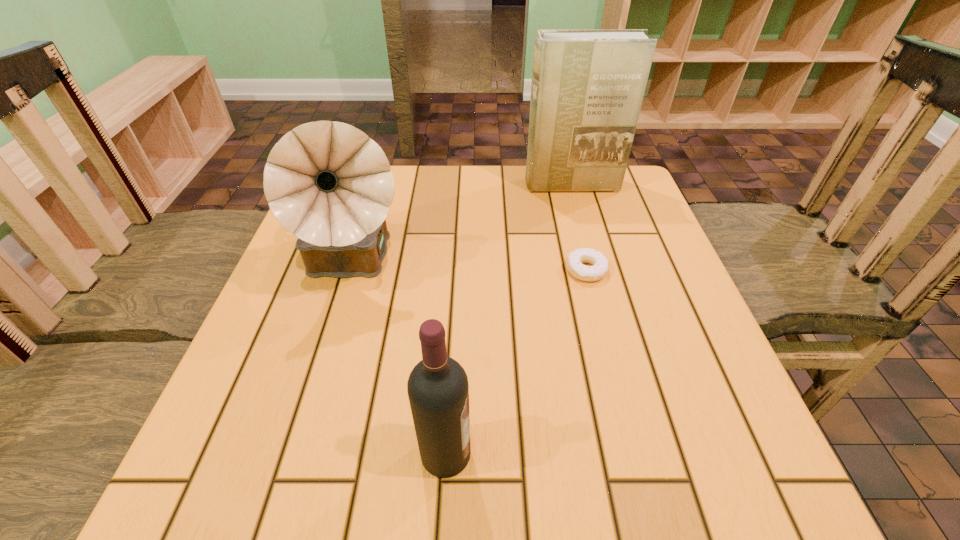
The height and width of the screenshot is (540, 960). I want to click on object present at the near edge, so click(438, 390).

This screenshot has height=540, width=960. Identify the location of object situated at the left edge. [328, 183].

I want to click on phonebook positioned at the right edge, so click(x=587, y=89).

What are the coordinates of `doughnut positioned at the right edge` in the screenshot? It's located at (575, 259).

At what (x,y) coordinates should I click in order to perform the action: click on object at the far right corner. Please return your answer as a coordinate pair (x, y). Looking at the image, I should click on (587, 89).

In the image, there is a desktop. Find the location of `free space at the far edge`. free space at the far edge is located at coordinates (425, 177).

In the image, there is a desktop. Where is `vacant space at the left edge`? Image resolution: width=960 pixels, height=540 pixels. vacant space at the left edge is located at coordinates (327, 370).

In the image, there is a desktop. Identify the location of free space at the right edge. The height and width of the screenshot is (540, 960). (595, 245).

What are the coordinates of `free region at the far right corner of the desktop` in the screenshot? It's located at (616, 216).

In the image, there is a desktop. At what (x,y) coordinates should I click in order to perform the action: click on free space at the near right corner. Please return your answer as a coordinate pair (x, y). Image resolution: width=960 pixels, height=540 pixels. Looking at the image, I should click on (657, 470).